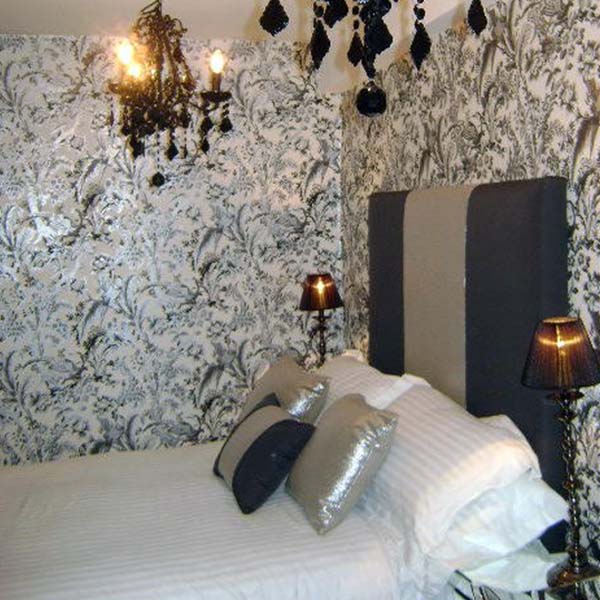
Locate an element on the screen. Image resolution: width=600 pixels, height=600 pixels. pillow is located at coordinates (343, 464).